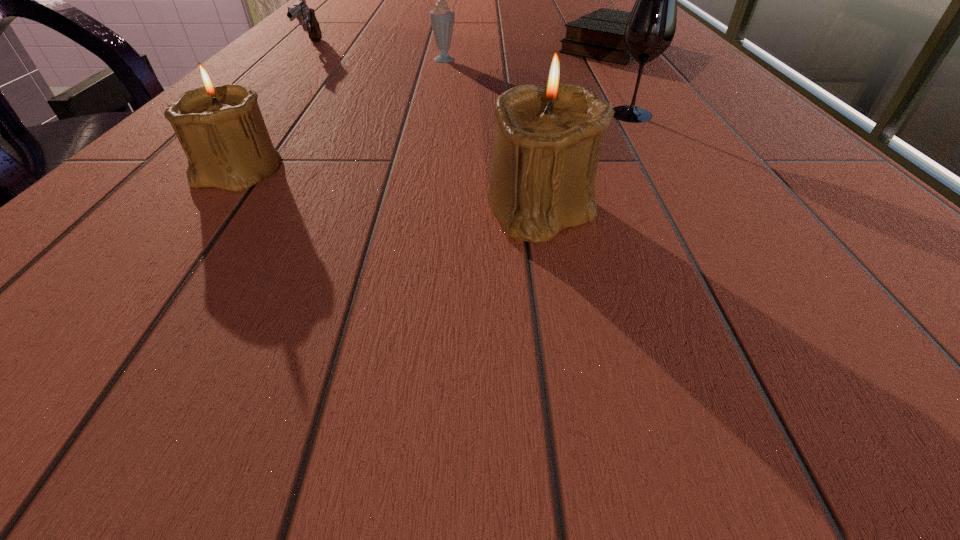
Where is `free space that satisfies the following two spatial constraints: 1. at the barrel of the pistol; 2. on the left side of the third object from right to left`? The width and height of the screenshot is (960, 540). free space that satisfies the following two spatial constraints: 1. at the barrel of the pistol; 2. on the left side of the third object from right to left is located at coordinates (162, 207).